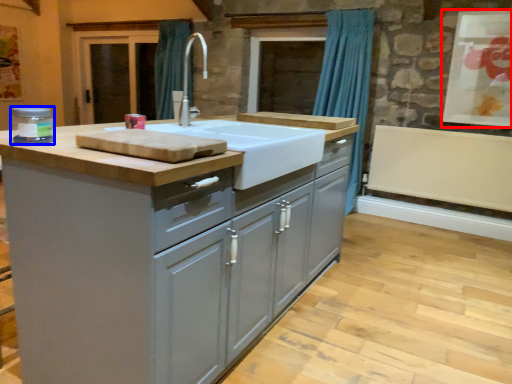
Question: Which object is further to the camera taking this photo, window screen (highlighted by a red box) or appliance (highlighted by a blue box)?

Choices:
 (A) window screen
 (B) appliance

Answer: (A)